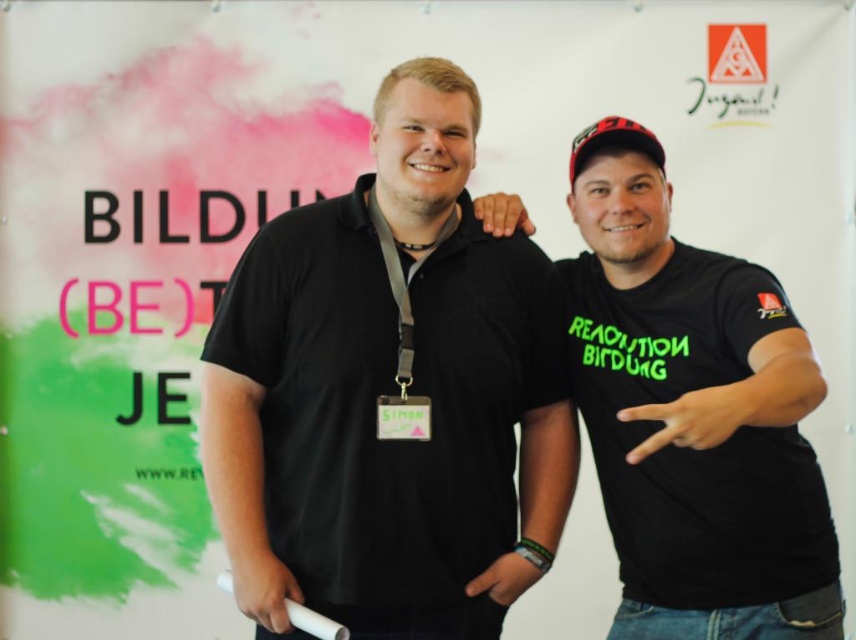
Question: Is black matte shirt at center closer to the viewer compared to black matte t-shirt at right?

Choices:
 (A) no
 (B) yes

Answer: (A)

Question: Based on their relative distances, which object is nearer to the black matte t-shirt at right?

Choices:
 (A) black matte shirt at center
 (B) white plastic game controller at lower center

Answer: (A)

Question: Is black matte t-shirt at right above white plastic game controller at lower center?

Choices:
 (A) yes
 (B) no

Answer: (A)

Question: Which object is closer to the camera taking this photo?

Choices:
 (A) white plastic game controller at lower center
 (B) black matte shirt at center
 (C) black matte t-shirt at right

Answer: (C)

Question: Can you confirm if black matte t-shirt at right is thinner than white plastic game controller at lower center?

Choices:
 (A) yes
 (B) no

Answer: (B)

Question: Which point is farther to the camera?

Choices:
 (A) black matte shirt at center
 (B) white plastic game controller at lower center

Answer: (A)